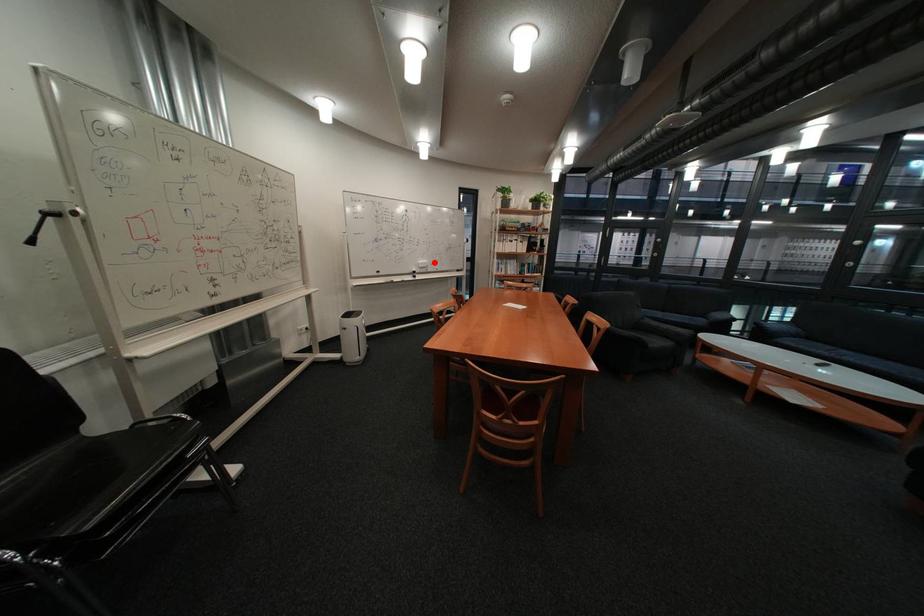
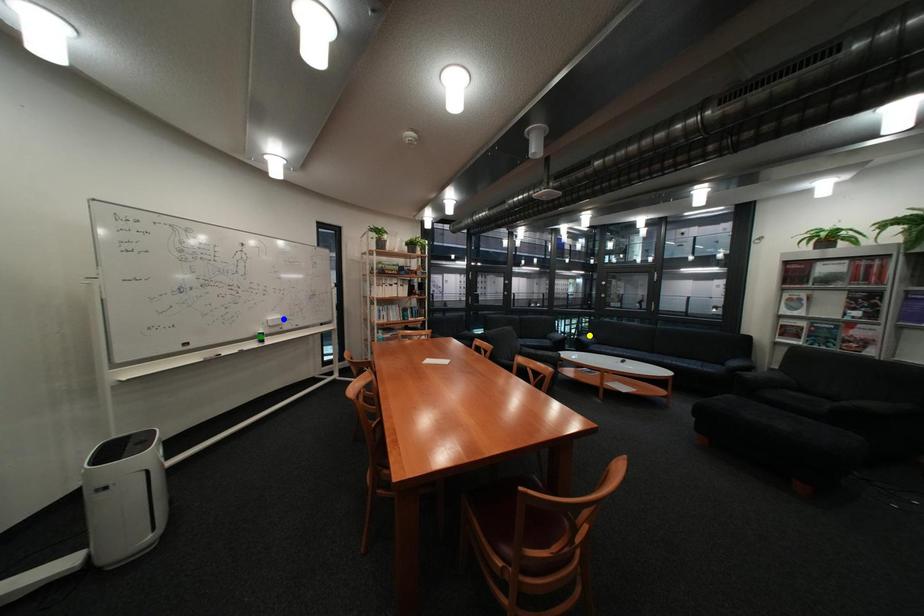
Question: I am providing you with two images of the same scene from different viewpoints. A red point is marked on the first image. You are given multiple points on the second image. Which spot in image 2 lines up with the point in image 1?

Choices:
 (A) yellow point
 (B) green point
 (C) blue point

Answer: (C)